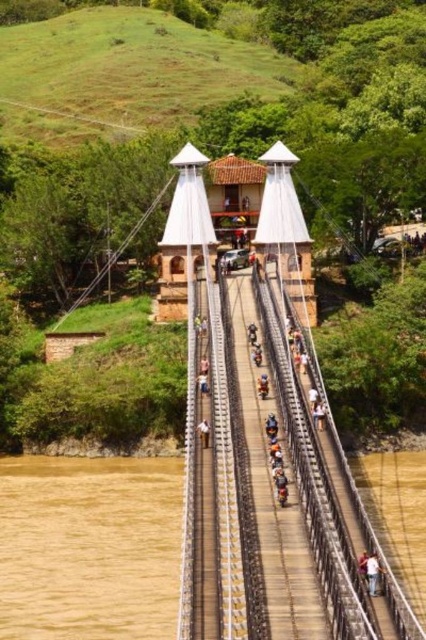
Describe the element at coordinates (89, 547) in the screenshot. I see `brown muddy water at lower left` at that location.

Is brown muddy water at lower left below white fabric person at center?

Correct, brown muddy water at lower left is located below white fabric person at center.

Does point (126, 563) come farther from viewer compared to point (201, 442)?

Yes, it is behind point (201, 442).

I want to click on brown muddy water at lower left, so click(x=89, y=547).

Consider the image. Between brown muddy water at lower left and light brown wooden bridge at center, which one is positioned higher?

light brown wooden bridge at center

Which is more to the left, brown muddy water at lower left or light brown wooden bridge at center?

brown muddy water at lower left is more to the left.

Find the location of a particular element. The width and height of the screenshot is (426, 640). brown muddy water at lower left is located at coordinates [x=89, y=547].

Image resolution: width=426 pixels, height=640 pixels. In order to click on brown muddy water at lower left in this screenshot , I will do (89, 547).

Can you confirm if light brown wooden bridge at center is positioned to the left of white fabric person at center?

Incorrect, light brown wooden bridge at center is not on the left side of white fabric person at center.

Is light brown wooden bridge at center thinner than white fabric person at center?

Incorrect, light brown wooden bridge at center's width is not less than white fabric person at center's.

Who is more forward, (368, 586) or (209, 436)?

Point (368, 586)

What are the coordinates of `light brown wooden bridge at center` in the screenshot? It's located at (373, 573).